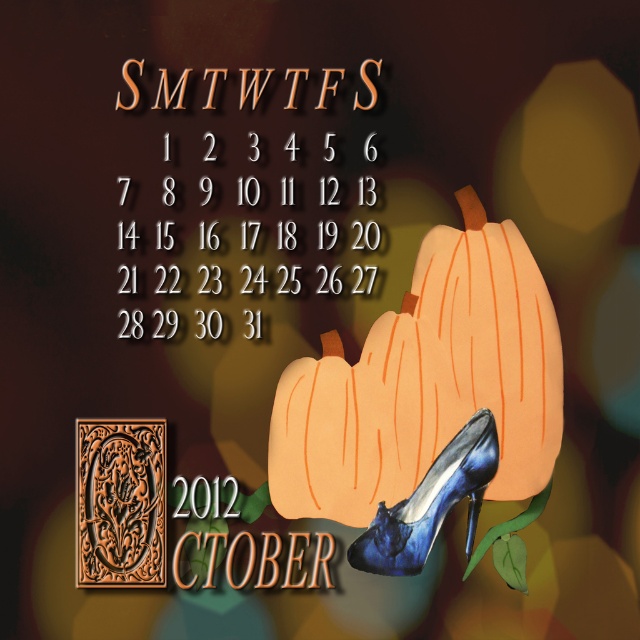
Question: Can you confirm if orange matte pumpkin at center is positioned to the right of blue satin high-heeled shoe at lower center?

Choices:
 (A) yes
 (B) no

Answer: (B)

Question: Does orange matte pumpkin at center appear on the left side of blue satin high-heeled shoe at lower center?

Choices:
 (A) yes
 (B) no

Answer: (A)

Question: Which point is farther to the camera?

Choices:
 (A) orange matte pumpkin at center
 (B) blue satin high-heeled shoe at lower center

Answer: (A)

Question: Is orange matte pumpkin at center further to camera compared to blue satin high-heeled shoe at lower center?

Choices:
 (A) no
 (B) yes

Answer: (B)

Question: Which object is farther from the camera taking this photo?

Choices:
 (A) orange matte pumpkin at center
 (B) blue satin high-heeled shoe at lower center

Answer: (A)